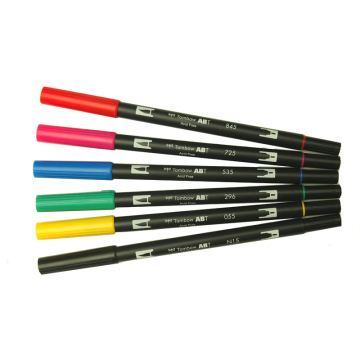
Identify the location of marker cap. The height and width of the screenshot is (360, 360). (79, 100), (74, 132), (78, 166), (88, 199), (90, 226), (94, 255).